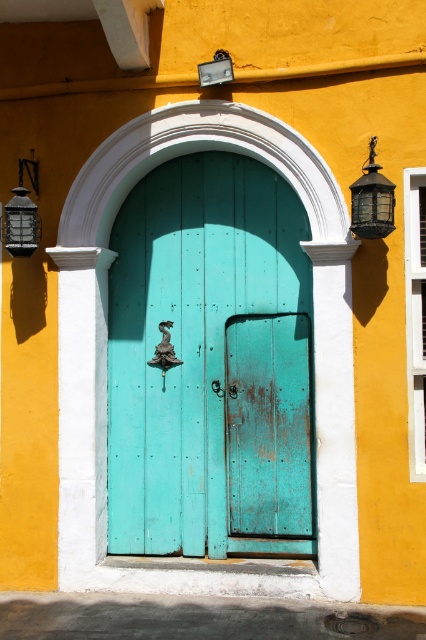
Question: Among these points, which one is farthest from the camera?

Choices:
 (A) (192, 470)
 (B) (230, 65)
 (C) (360, 196)

Answer: (A)

Question: Can you confirm if matte black lantern at upper right is positioned to the left of matte black lantern at left?

Choices:
 (A) yes
 (B) no

Answer: (B)

Question: Is teal wooden door at center above metallic glass at upper center?

Choices:
 (A) yes
 (B) no

Answer: (B)

Question: Which of these objects is positioned farthest from the matte black lantern at upper right?

Choices:
 (A) metallic glass at upper center
 (B) teal wooden door at center
 (C) matte black lantern at left

Answer: (C)

Question: Which object is farther from the camera taking this photo?

Choices:
 (A) matte black lantern at upper right
 (B) metallic glass at upper center
 (C) teal wooden door at center

Answer: (C)

Question: Does teal wooden door at center appear under metallic glass at upper center?

Choices:
 (A) no
 (B) yes

Answer: (B)